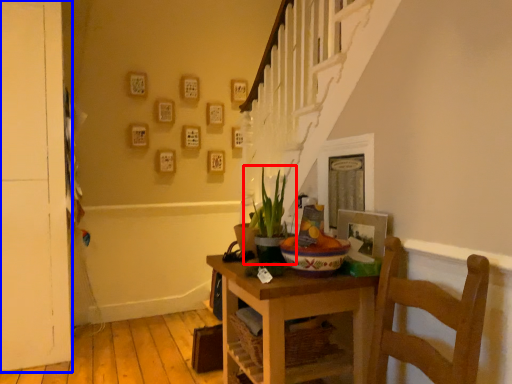
Question: Which point is further to the camera, houseplant (highlighted by a red box) or door (highlighted by a blue box)?

Choices:
 (A) houseplant
 (B) door

Answer: (B)